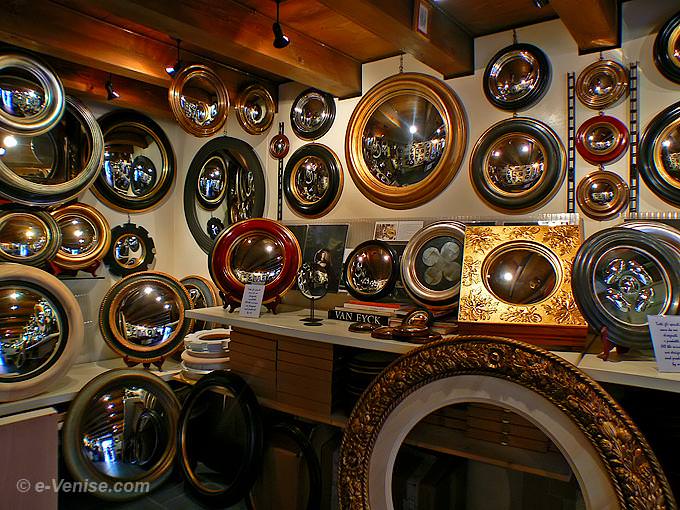
You are a GUI agent. You are given a task and a screenshot of the screen. Output one action in this format:
    pyautogui.click(x=<x>, y=<y>)
    Task: Click on the cream colored walls
    This screenshot has height=510, width=680.
    Given the screenshot: What is the action you would take?
    pyautogui.click(x=476, y=99), pyautogui.click(x=158, y=234)